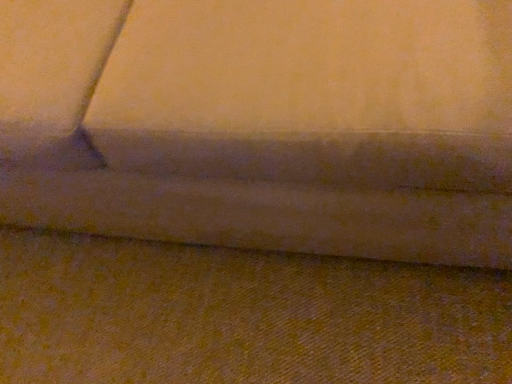
Find the location of `free space above yellow fabric at lower center (from a real-world perspective)`. free space above yellow fabric at lower center (from a real-world perspective) is located at coordinates (211, 309).